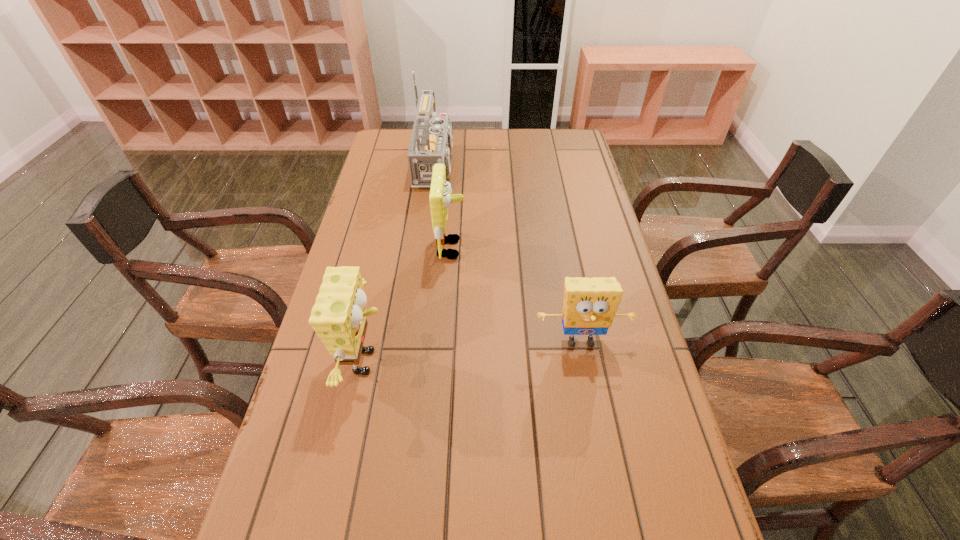
This screenshot has height=540, width=960. What are the coordinates of `radio receiver` in the screenshot? It's located at (431, 142).

Identify the location of the farthest object. This screenshot has width=960, height=540. (431, 142).

The image size is (960, 540). In order to click on the second sponge from left to right in this screenshot , I will do (440, 198).

The image size is (960, 540). In order to click on the third nearest object in this screenshot , I will do `click(440, 198)`.

Locate an element on the screen. The width and height of the screenshot is (960, 540). the leftmost sponge is located at coordinates (338, 317).

Locate an element on the screen. This screenshot has height=540, width=960. the rightmost sponge is located at coordinates (589, 306).

The width and height of the screenshot is (960, 540). I want to click on the rightmost object, so click(589, 306).

You are a GUI agent. You are given a task and a screenshot of the screen. Output one action in this format:
    pyautogui.click(x=<x>, y=<y>)
    Task: Click on the free space located 0.220m on the front-facing side of the farthest object
    The width and height of the screenshot is (960, 540).
    Given the screenshot: What is the action you would take?
    pyautogui.click(x=525, y=166)

Where is `vacant space situated 0.060m on the face of the second sponge from left to right`? vacant space situated 0.060m on the face of the second sponge from left to right is located at coordinates (486, 248).

Where is `vacant space situated 0.180m on the front-facing side of the leftmost sponge`? vacant space situated 0.180m on the front-facing side of the leftmost sponge is located at coordinates tap(467, 362).